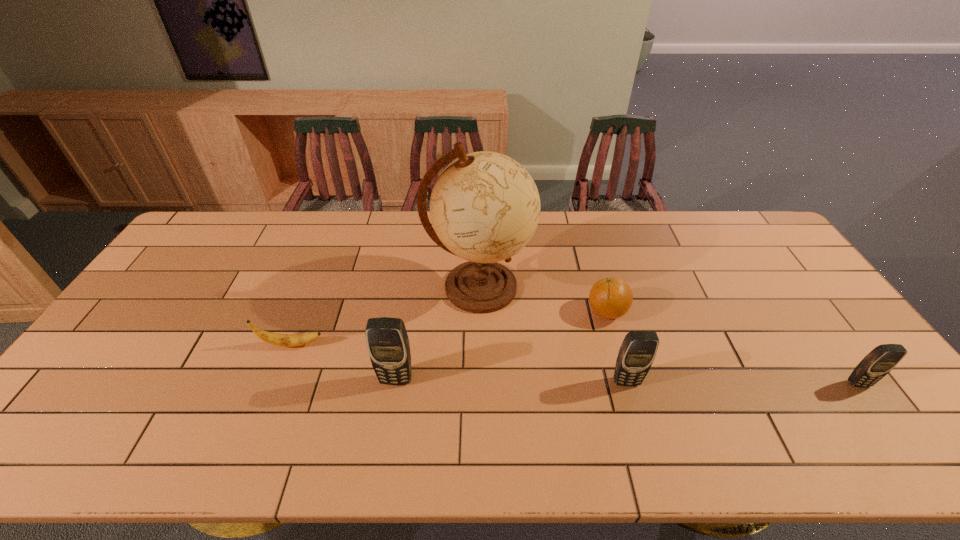
With all cellular telephones evenly spaced, where should an extra cellular telephone be placed on the left to continue the pattern? Please point out a vacant space. Please provide its 2D coordinates. Your answer should be formatted as a tuple, i.e. [(x, y)], where the tuple contains the x and y coordinates of a point satisfying the conditions above.

[(167, 377)]